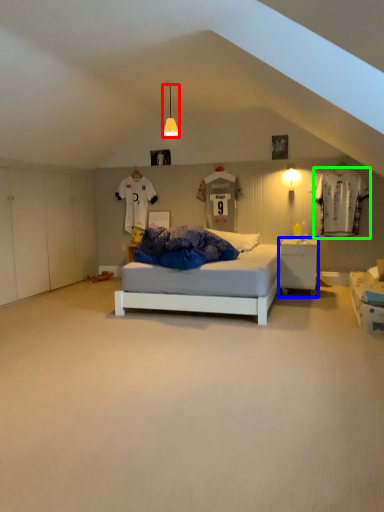
Question: Which object is the closest to the light fixture (highlighted by a red box)? Choose among these: nightstand (highlighted by a blue box) or laundry (highlighted by a green box).

Choices:
 (A) nightstand
 (B) laundry

Answer: (A)